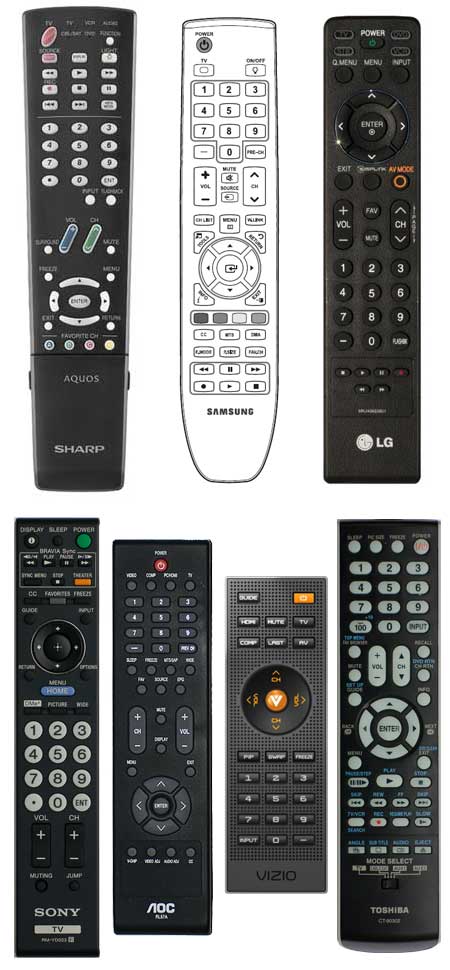
Where is `remotes`? This screenshot has height=970, width=450. remotes is located at coordinates (90, 280), (247, 277), (356, 294), (51, 600), (143, 593), (272, 609), (383, 595).